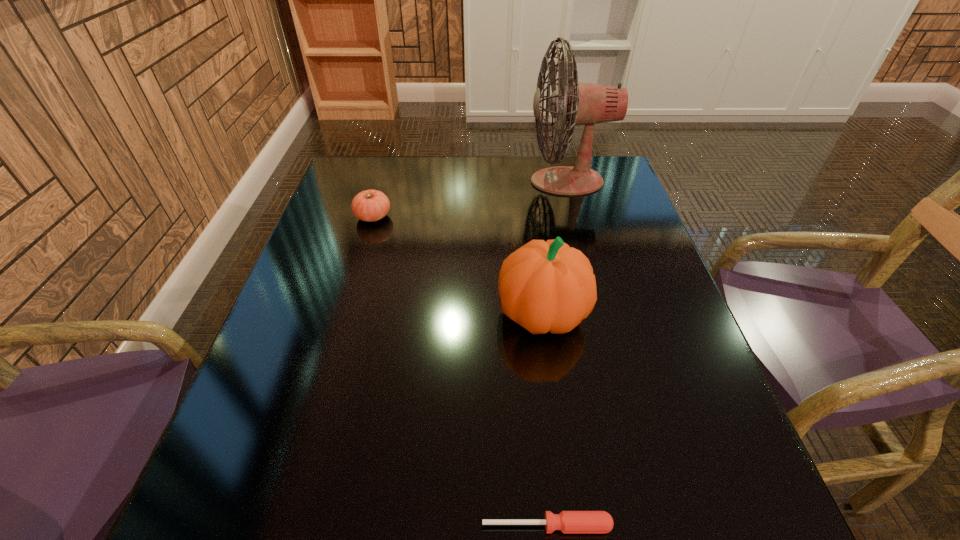
This screenshot has height=540, width=960. Identify the location of fan. (578, 103).

Identify the location of the third farthest object. (543, 286).

The width and height of the screenshot is (960, 540). Find the location of `the third shortest object`. the third shortest object is located at coordinates (543, 286).

Image resolution: width=960 pixels, height=540 pixels. In order to click on the leftmost object in this screenshot , I will do `click(370, 205)`.

This screenshot has width=960, height=540. What are the coordinates of `tomato` in the screenshot? It's located at [x=370, y=205].

You are a GUI agent. You are given a task and a screenshot of the screen. Output one action in this format:
    pyautogui.click(x=<x>, y=<y>)
    Task: Click on the nearest object
    
    Given the screenshot: What is the action you would take?
    pyautogui.click(x=567, y=521)

Locate an element on the screen. The height and width of the screenshot is (540, 960). screwdriver is located at coordinates (567, 521).

Locate an element on the screen. vacant point located 0.330m in front of the tallest object to direct airflow is located at coordinates (417, 181).

This screenshot has height=540, width=960. I want to click on free space located in front of the tallest object to direct airflow, so click(x=500, y=181).

I want to click on free space located 0.060m in front of the tallest object to direct airflow, so click(507, 181).